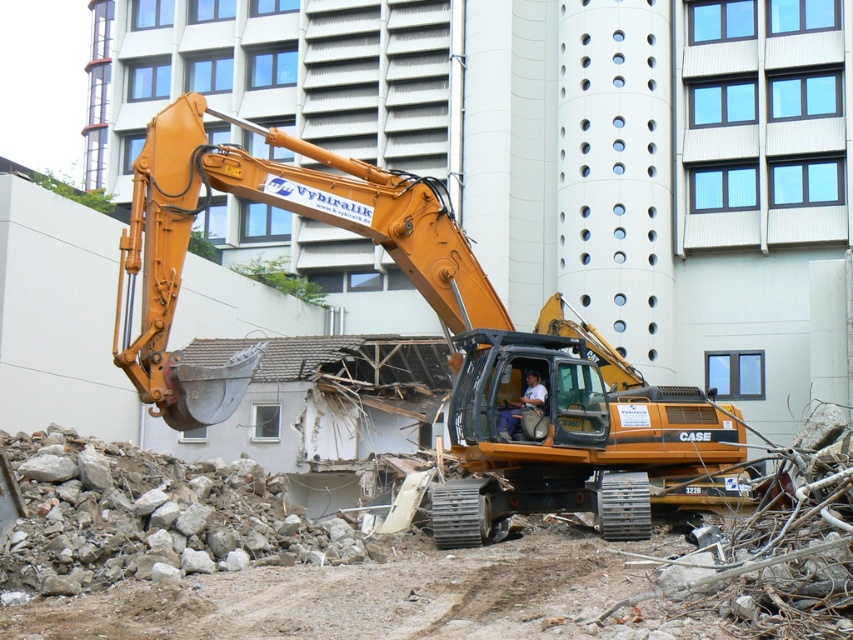
Measure the distance between point (596, 387) and camera.

A distance of 19.41 meters exists between point (596, 387) and camera.

Can you confirm if orange metallic excavator at center is wider than light brown leather jacket at center?

Yes, orange metallic excavator at center is wider than light brown leather jacket at center.

Identify the location of orange metallic excavator at center. (444, 336).